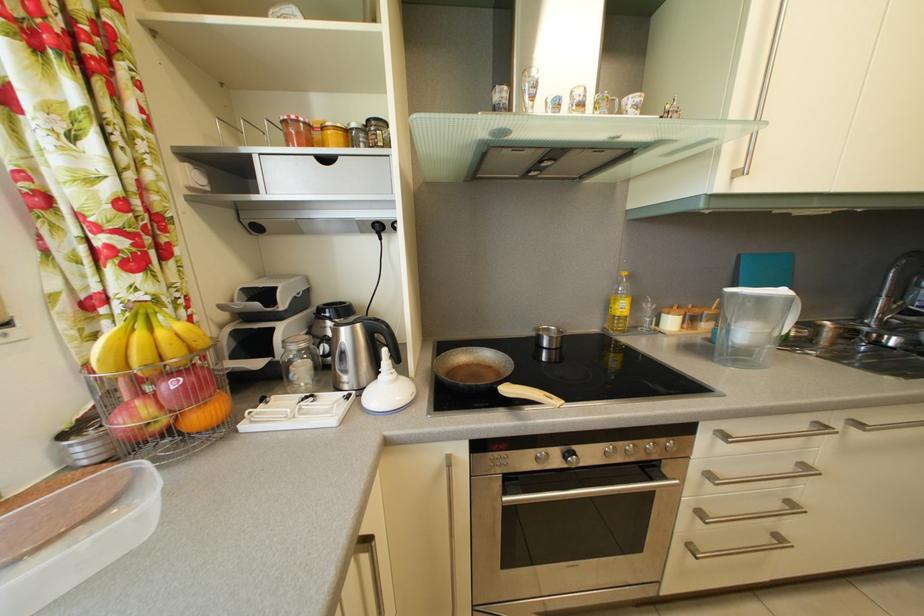
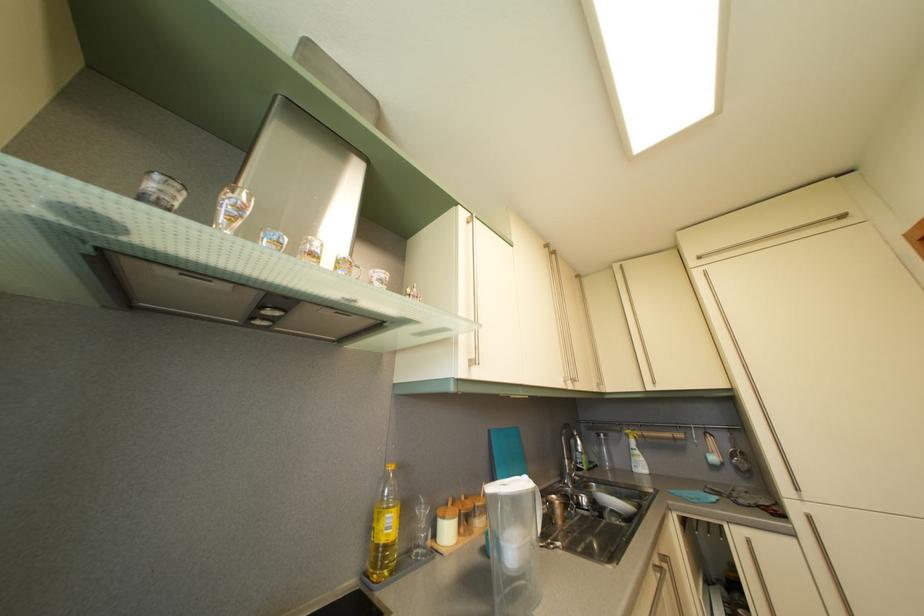
Locate, in the second image, the point that corresponds to (747,264) in the first image.

(497, 439)